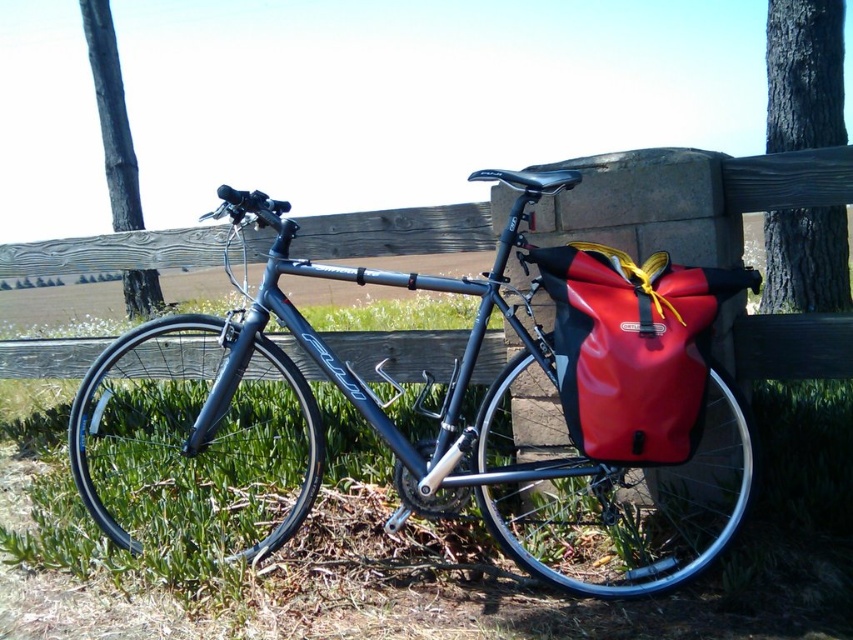
You are a cyclist who just arrived at the fence and want to attach your new yellow fabric strap to your bike. The wooden fence is in front of you. Where should you place the yellow fabric strap at right relative to the wooden at center to match the original image?

The yellow fabric strap at right should be placed behind the wooden at center to match the original image.

You are a delivery person who needs to attach a small package to the wooden at center and the red matte bag at right. Which object is shorter and thus better suited for placing the package at a lower height?

The wooden at center is shorter than the red matte bag at right, so it is better suited for placing the package at a lower height.